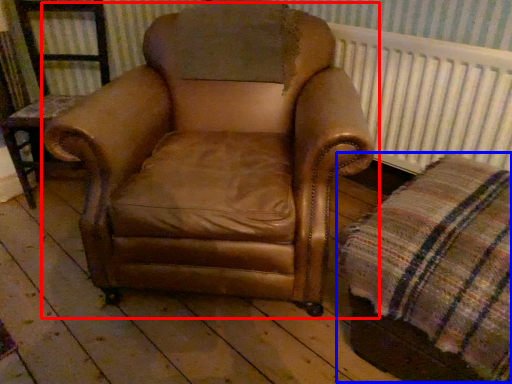
Question: Among these objects, which one is farthest to the camera, chair (highlighted by a red box) or plaid (highlighted by a blue box)?

Choices:
 (A) chair
 (B) plaid

Answer: (A)